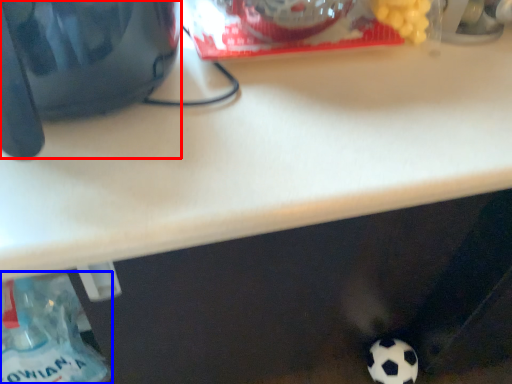
Question: Which object appears closest to the camera in this image, appliance (highlighted by a red box) or bottle (highlighted by a blue box)?

Choices:
 (A) appliance
 (B) bottle

Answer: (A)